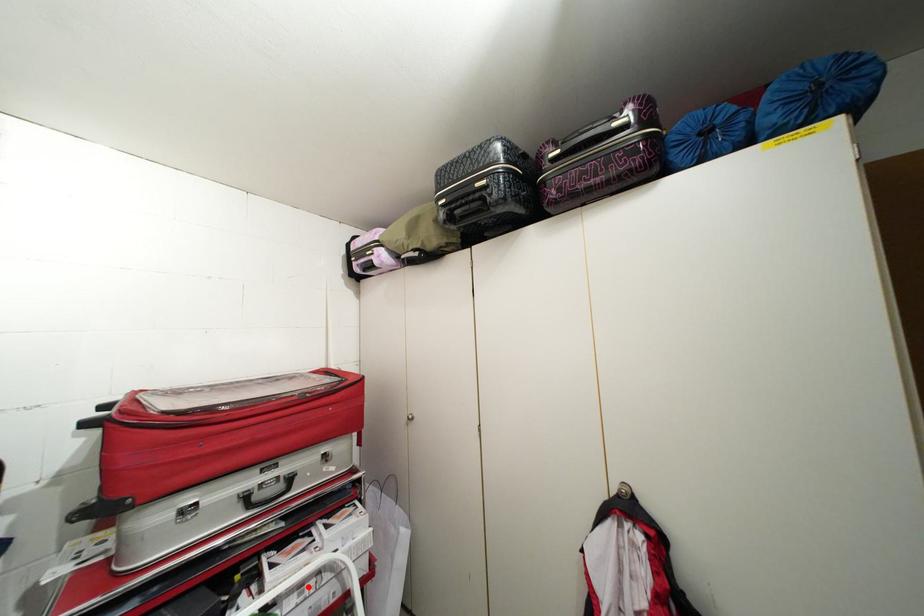
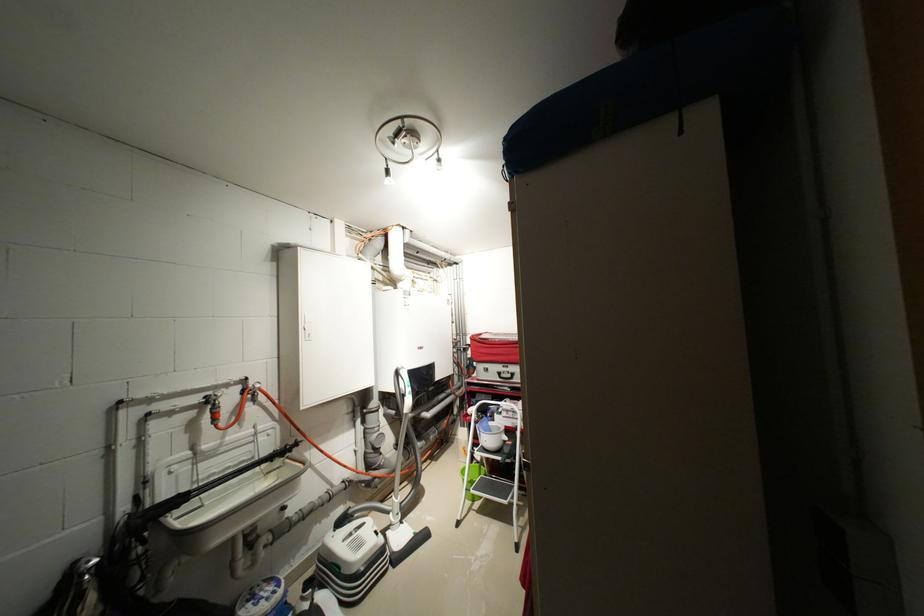
Locate, in the second image, the point that corresponds to the highlighted location in the first image.

(515, 411)